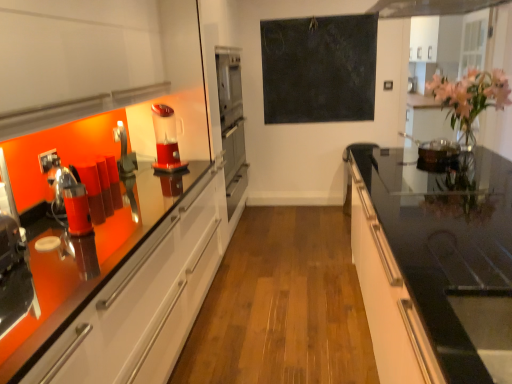
Question: Does black glass countertop at right appear on the right side of red plastic blender at center, placed as the second coffee machine when sorted from front to back?

Choices:
 (A) no
 (B) yes

Answer: (B)

Question: From a real-world perspective, is black glass countertop at right on red plastic blender at center, the 1th coffee machine positioned from the right?

Choices:
 (A) no
 (B) yes

Answer: (A)

Question: Is red plastic blender at center, placed as the second coffee machine when sorted from front to back, inside black glass countertop at right?

Choices:
 (A) no
 (B) yes

Answer: (A)

Question: Is black glass countertop at right positioned beyond the bounds of red plastic blender at center, positioned as the second coffee machine in bottom-to-top order?

Choices:
 (A) yes
 (B) no

Answer: (A)

Question: Can you confirm if black glass countertop at right is taller than red plastic blender at center, arranged as the second coffee machine when viewed from the left?

Choices:
 (A) no
 (B) yes

Answer: (B)

Question: Is metallic silver blender at left taller or shorter than dark matte chalkboard at center?

Choices:
 (A) tall
 (B) short

Answer: (B)

Question: In terms of size, does metallic silver blender at left appear bigger or smaller than dark matte chalkboard at center?

Choices:
 (A) big
 (B) small

Answer: (B)

Question: Considering the relative positions of metallic silver blender at left and dark matte chalkboard at center in the image provided, is metallic silver blender at left to the left or to the right of dark matte chalkboard at center?

Choices:
 (A) left
 (B) right

Answer: (A)

Question: From the image's perspective, is metallic silver blender at left above or below dark matte chalkboard at center?

Choices:
 (A) below
 (B) above

Answer: (A)

Question: Considering the positions of satin silver oven at center and pink glossy vase at upper right in the image, is satin silver oven at center bigger or smaller than pink glossy vase at upper right?

Choices:
 (A) small
 (B) big

Answer: (B)

Question: From the image's perspective, relative to pink glossy vase at upper right, is satin silver oven at center above or below?

Choices:
 (A) below
 (B) above

Answer: (A)

Question: Is point (245, 162) closer or farther from the camera than point (461, 105)?

Choices:
 (A) farther
 (B) closer

Answer: (A)

Question: In terms of height, does satin silver oven at center look taller or shorter compared to pink glossy vase at upper right?

Choices:
 (A) tall
 (B) short

Answer: (A)

Question: From a real-world perspective, relative to dark matte chalkboard at center, is matte black coffee machine at left, the 1th coffee machine when ordered from bottom to top, vertically above or below?

Choices:
 (A) below
 (B) above

Answer: (A)

Question: Looking at the image, does matte black coffee machine at left, the 2th coffee machine positioned from the top, seem bigger or smaller compared to dark matte chalkboard at center?

Choices:
 (A) big
 (B) small

Answer: (B)